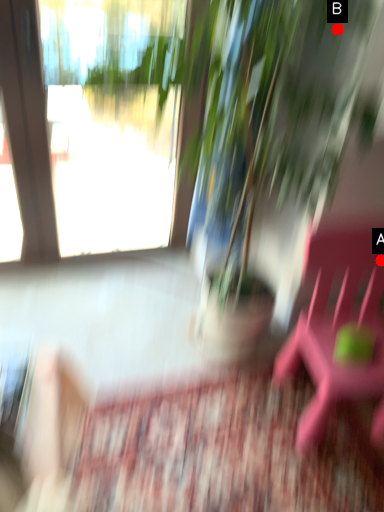
Question: Two points are circled on the image, labeled by A and B beside each circle. Which point is farther from the camera taking this photo?

Choices:
 (A) A is further
 (B) B is further

Answer: (A)